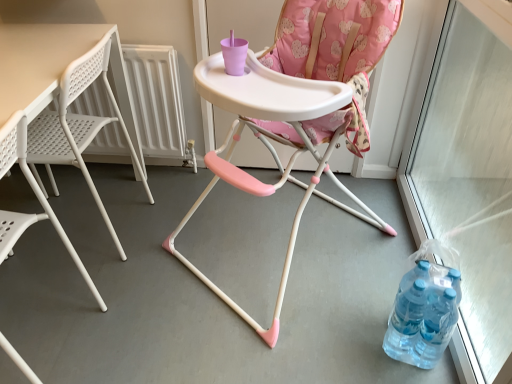
Find the location of a particular element. The width and height of the screenshot is (512, 384). vacant space in between white plastic chair at left, the second chair when ordered from right to left, and translucent plastic bottles at lower right is located at coordinates (233, 338).